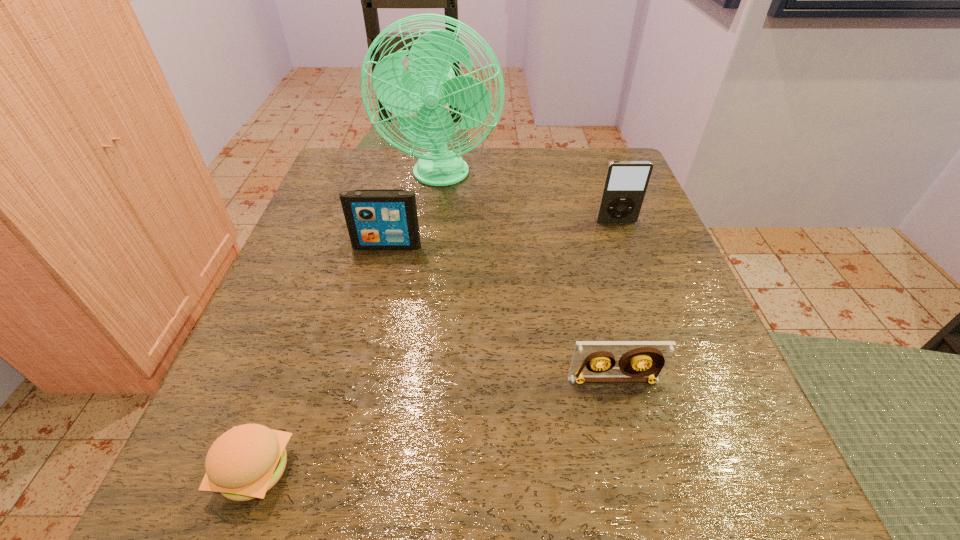
The image size is (960, 540). I want to click on free space located in front of the fan to blow air, so click(426, 297).

You are a GUI agent. You are given a task and a screenshot of the screen. Output one action in this format:
    pyautogui.click(x=<x>, y=<y>)
    Task: Click on the blank space located on the front-facing side of the fourth nearest object
    The image size is (960, 540).
    Given the screenshot: What is the action you would take?
    pyautogui.click(x=682, y=400)

At what (x,y) coordinates should I click in order to perform the action: click on free region located on the front screen of the left iPod. Please return your answer as a coordinate pair (x, y). Image resolution: width=960 pixels, height=540 pixels. Looking at the image, I should click on (363, 349).

You are a GUI agent. You are given a task and a screenshot of the screen. Output one action in this format:
    pyautogui.click(x=<x>, y=<y>)
    Task: Click on the free space located at the front of the videotape with visible reels
    The image size is (960, 540).
    Given the screenshot: What is the action you would take?
    pyautogui.click(x=645, y=505)

Locate an element on the screen. blank space located on the back of the shortest object is located at coordinates (335, 251).

This screenshot has height=540, width=960. I want to click on object that is at the far edge, so click(430, 83).

Locate an element on the screen. This screenshot has width=960, height=540. object present at the near edge is located at coordinates (245, 462).

This screenshot has width=960, height=540. I want to click on fan that is at the left edge, so click(430, 83).

Identify the location of iPod situated at the left edge. (377, 219).

You are a GUI agent. You are given a task and a screenshot of the screen. Output one action in this format:
    pyautogui.click(x=<x>, y=<y>)
    Task: Click on the hamburger located in the left edge section of the desktop
    The height and width of the screenshot is (540, 960).
    Given the screenshot: What is the action you would take?
    pyautogui.click(x=245, y=462)